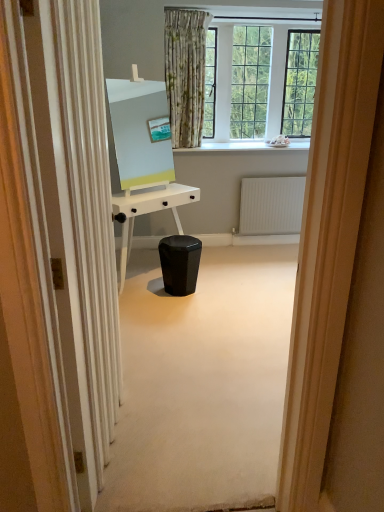
Question: In the image, is matte white easel at center on the left side or the right side of black glossy music stool at center?

Choices:
 (A) left
 (B) right

Answer: (A)

Question: Is matte white easel at center inside or outside of black glossy music stool at center?

Choices:
 (A) inside
 (B) outside

Answer: (B)

Question: Considering the real-world distances, which object is closest to the black glossy music stool at center?

Choices:
 (A) white textured radiator at center
 (B) white glossy desk at center
 (C) white glossy screen door at left
 (D) matte white easel at center

Answer: (B)

Question: Which object is the closest to the black glossy music stool at center?

Choices:
 (A) white glossy desk at center
 (B) white glossy screen door at left
 (C) white textured radiator at center
 (D) matte white easel at center

Answer: (A)